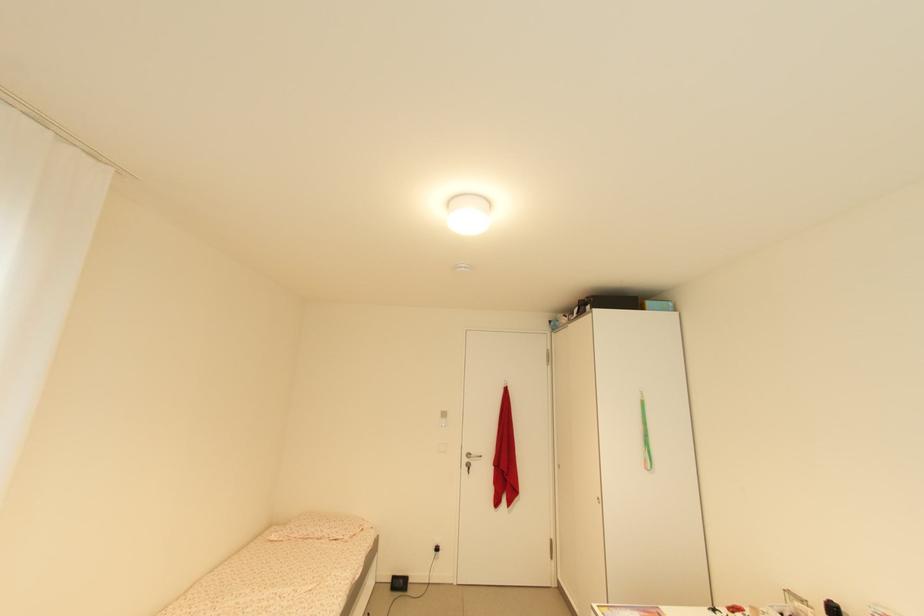
This screenshot has height=616, width=924. Find the location of `white light switch`. white light switch is located at coordinates (443, 418).